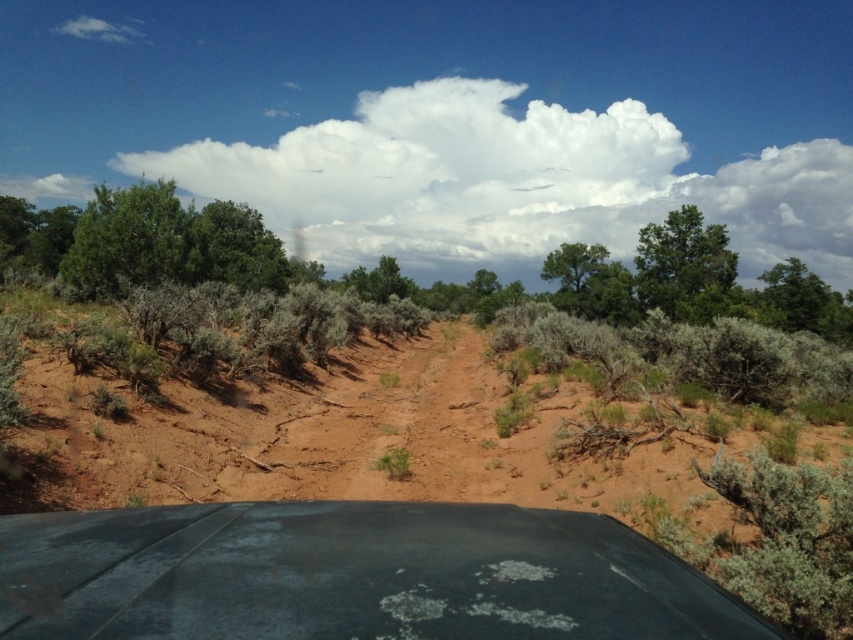
Which is more to the left, matte black windshield at center or white fluffy cloud at upper center?

matte black windshield at center

Can you confirm if matte black windshield at center is positioned below white fluffy cloud at upper center?

Correct, matte black windshield at center is located below white fluffy cloud at upper center.

Where is `matte black windshield at center`? The image size is (853, 640). matte black windshield at center is located at coordinates (351, 576).

Locate an element on the screen. This screenshot has width=853, height=640. matte black windshield at center is located at coordinates tap(351, 576).

Does matte black windshield at center have a greater width compared to green leafy tree at right?

No.

Does matte black windshield at center have a smaller size compared to green leafy tree at right?

Yes, matte black windshield at center is smaller than green leafy tree at right.

Where is `matte black windshield at center`? Image resolution: width=853 pixels, height=640 pixels. matte black windshield at center is located at coordinates (351, 576).

Who is taller, white fluffy cloud at upper center or green leafy tree at upper center?

white fluffy cloud at upper center

Is white fluffy cloud at upper center below green leafy tree at upper center?

Incorrect, white fluffy cloud at upper center is not positioned below green leafy tree at upper center.

Where is `white fluffy cloud at upper center`? white fluffy cloud at upper center is located at coordinates [511, 182].